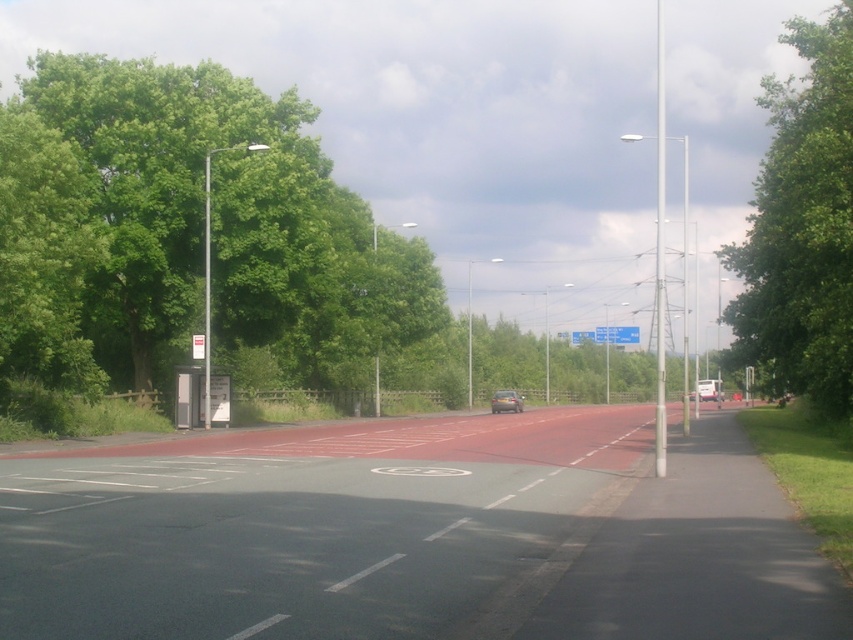
How much distance is there between green leafy tree at left and matte silver car at center?

green leafy tree at left and matte silver car at center are 23.14 meters apart.

From the picture: Can you confirm if green leafy tree at left is thinner than matte silver car at center?

In fact, green leafy tree at left might be wider than matte silver car at center.

This screenshot has height=640, width=853. I want to click on green leafy tree at left, so click(196, 228).

This screenshot has width=853, height=640. Find the location of `green leafy tree at left`. green leafy tree at left is located at coordinates (196, 228).

Between point (276, 164) and point (808, 321), which one is positioned in front?

Point (808, 321) is more forward.

Identify the location of green leafy tree at left. (196, 228).

Is blue plastic sign at center further to the viewer compared to matte silver car at center?

Yes, blue plastic sign at center is behind matte silver car at center.

Does blue plastic sign at center have a larger size compared to matte silver car at center?

Correct, blue plastic sign at center is larger in size than matte silver car at center.

Find the location of a particular element. This screenshot has width=853, height=640. blue plastic sign at center is located at coordinates (616, 333).